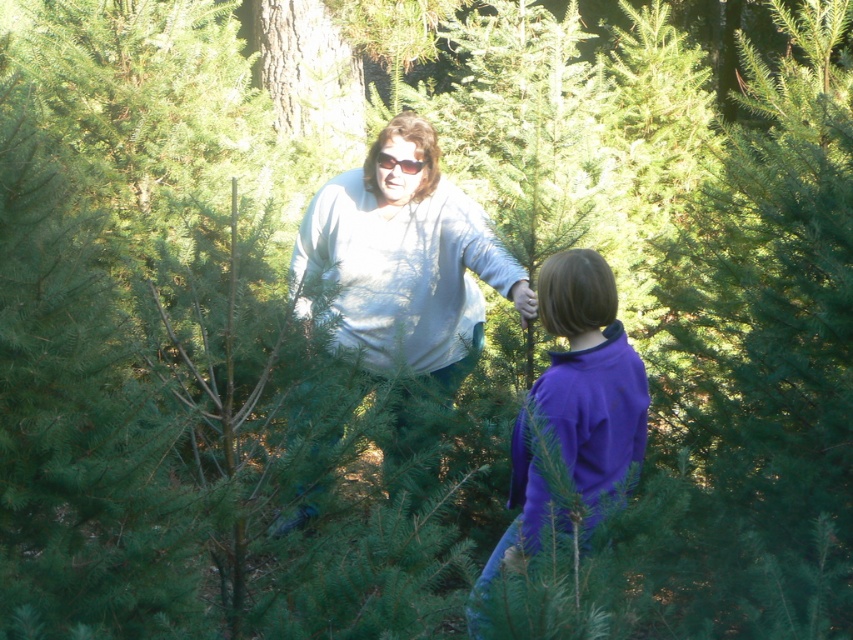
Consider the image. Which is more to the left, white matte sweater at center or purple fleece jacket at center?

From the viewer's perspective, white matte sweater at center appears more on the left side.

In the scene shown: Who is taller, white matte sweater at center or purple fleece jacket at center?

white matte sweater at center is taller.

Find the location of a particular element. The width and height of the screenshot is (853, 640). white matte sweater at center is located at coordinates (405, 259).

Where is `white matte sweater at center`? white matte sweater at center is located at coordinates (405, 259).